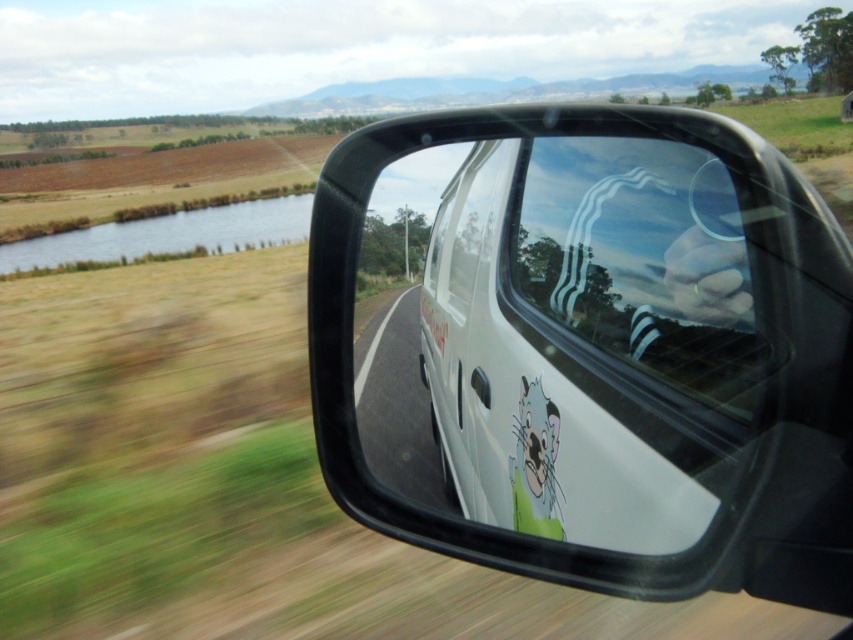
What object is located at the coordinates point (589, 346) in the scene?

The point (589, 346) marks the location of the black plastic mirror at center.